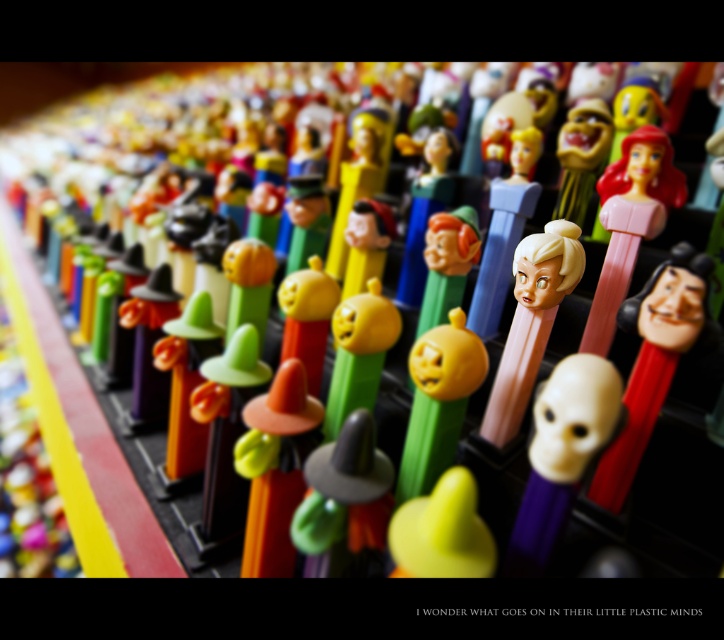
Question: Among these points, which one is farthest from the camera?

Choices:
 (A) (529, 540)
 (B) (466, 371)

Answer: (B)

Question: Is orange matte cone at center closer to camera compared to matte yellow plastic pumpkin at center?

Choices:
 (A) no
 (B) yes

Answer: (B)

Question: Does orange matte cone at center have a lesser width compared to orange matte pumpkin at center?

Choices:
 (A) yes
 (B) no

Answer: (B)

Question: Does pink matte plastic pez dispenser at center have a smaller size compared to matte yellow plastic pumpkin at center?

Choices:
 (A) yes
 (B) no

Answer: (B)

Question: Which object is positioned closest to the orange matte cone at center?

Choices:
 (A) pink matte plastic pez dispenser at center
 (B) orange matte pumpkin at center

Answer: (B)

Question: Which point is closer to the camera?

Choices:
 (A) (618, 406)
 (B) (432, 433)
 (C) (348, 316)

Answer: (A)